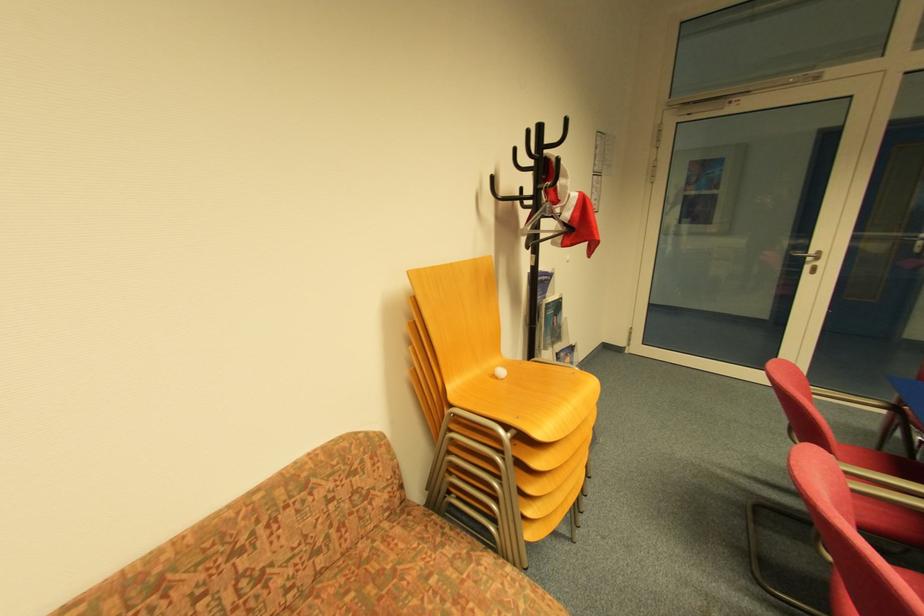
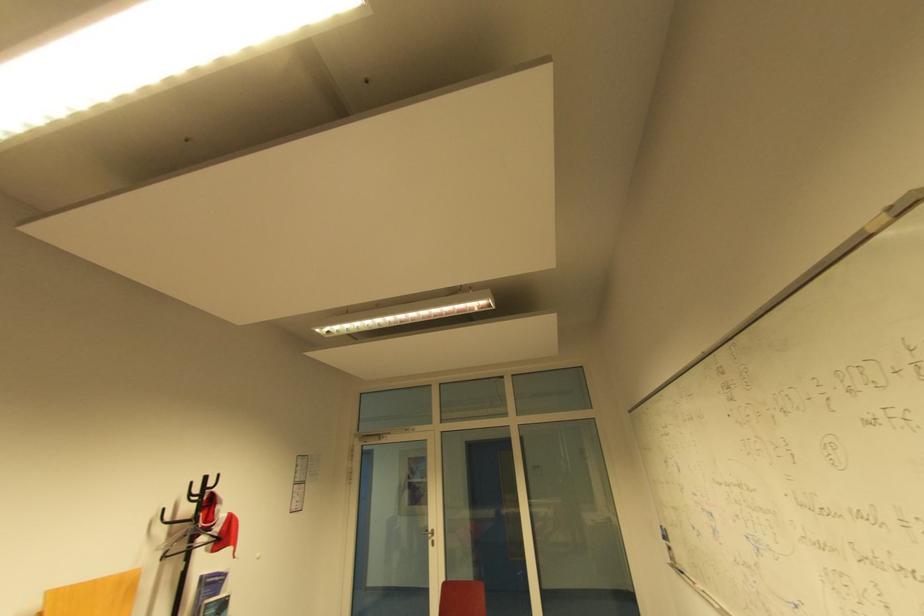
Find the pixel in the second image that matches [817,253] in the first image.

(434, 531)